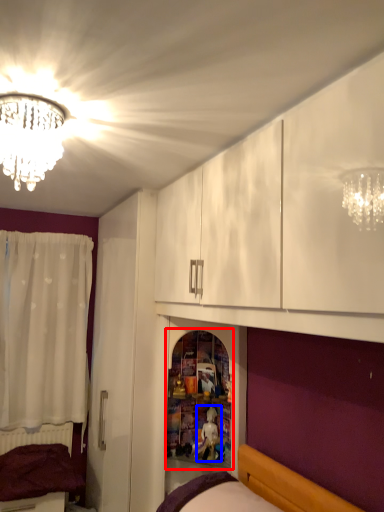
Question: Which object appears closest to the camera in this image, shelf (highlighted by a red box) or toy (highlighted by a blue box)?

Choices:
 (A) shelf
 (B) toy

Answer: (A)